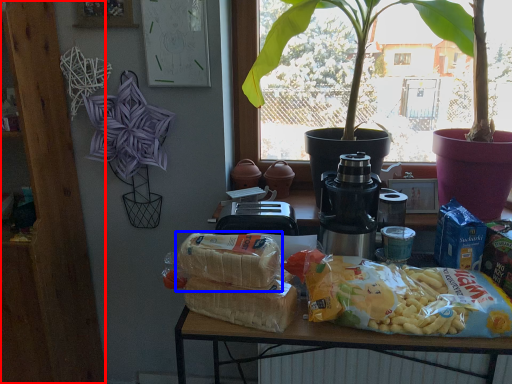
Question: Which object appears closest to the camera in this image, bookshelf (highlighted by a red box) or yoghurt (highlighted by a blue box)?

Choices:
 (A) bookshelf
 (B) yoghurt

Answer: (B)